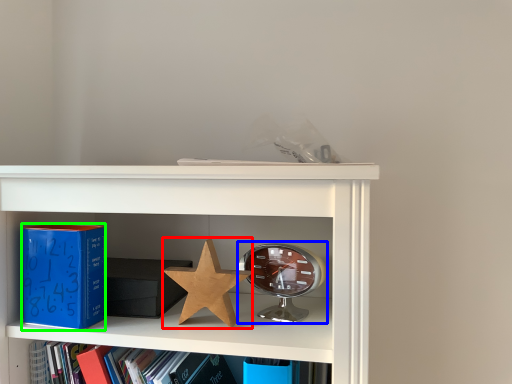
Question: Which object is positioned closest to star (highlighted by a red box)? Select from alarm clock (highlighted by a blue box) and paperback book (highlighted by a green box).

Choices:
 (A) alarm clock
 (B) paperback book

Answer: (A)